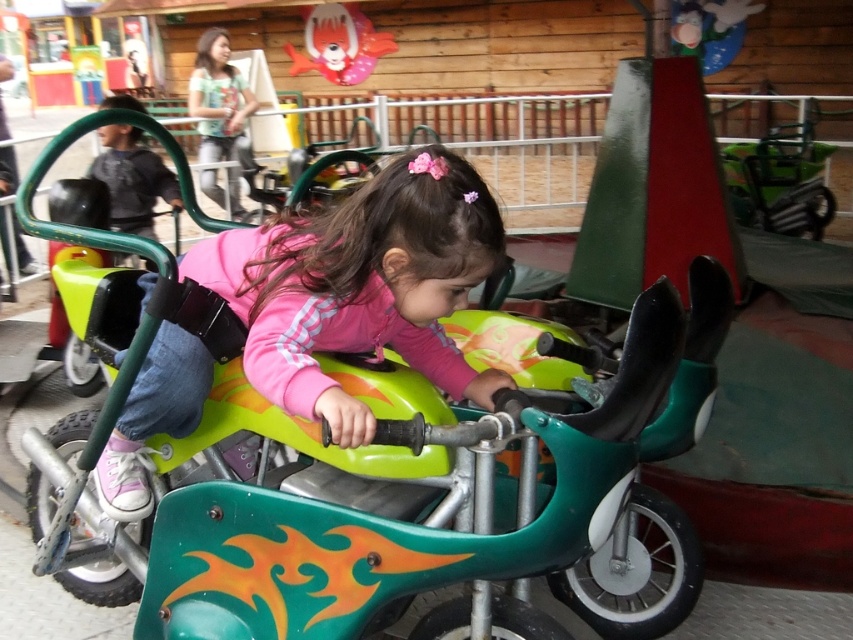
What is the object located at the coordinates point (360, 285) in the image?

The object at point (360, 285) is the matte green motorcycle at center.

You are a parent at the amusement park and want to take a photo of your child sitting on the matte green motorcycle at center. You notice a shiny plastic balloon at upper center nearby. Where should you position yourself to ensure both the motorcycle and the balloon are in the frame?

Position yourself so that the shiny plastic balloon at upper center is above the matte green motorcycle at center in the photo, as the motorcycle is positioned under the balloon.

Where is the matte green motorcycle at center located in the image?

The matte green motorcycle at center is located at point (360, 285).